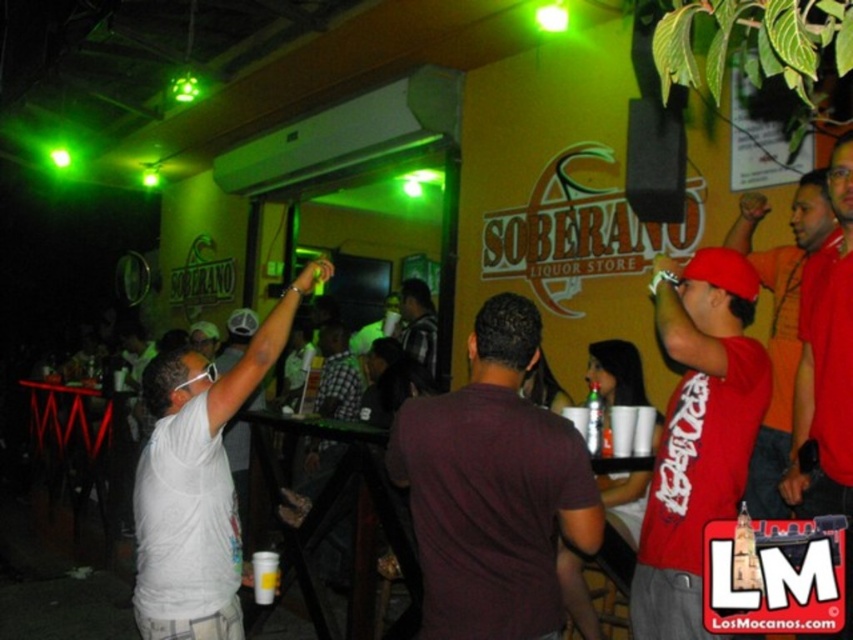
You are at the SOBERANO Liquor Store and see two people wearing red. One is wearing a red matte shirt at right and the other a red matte baseball cap at center. From your perspective, which one is positioned more to the left?

The red matte shirt at right is positioned more to the left compared to the red matte baseball cap at center.

You are at the SOBERANO Liquor Store and notice two red items in the room. One is the red matte shirt at right and the other is the red matte baseball cap at center. Which of these two items is taller?

The red matte shirt at right is much taller than the red matte baseball cap at center.